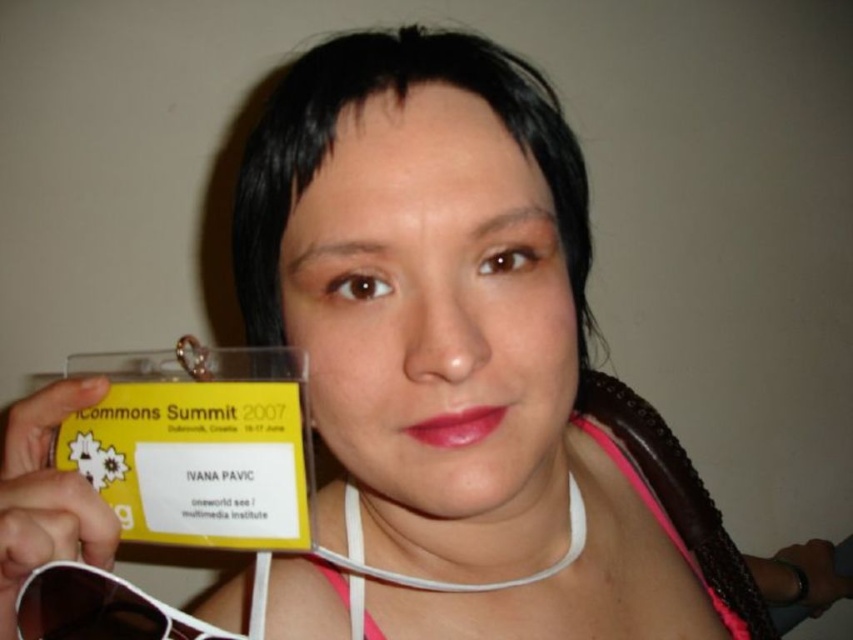
Is point (71, 637) closer to camera compared to point (345, 493)?

Yes, point (71, 637) is closer to viewer.

Is point (67, 572) in front of point (699, 566)?

Yes, it is in front of point (699, 566).

I want to click on black plastic sunglasses at lower left, so click(99, 609).